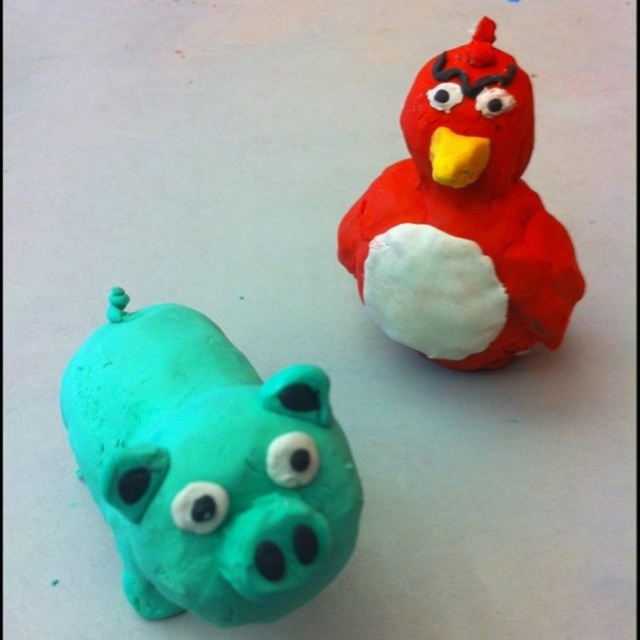
Based on the photo, which is below, teal clay pig at lower left or matte red clay bird at upper right?

teal clay pig at lower left is below.

Is teal clay pig at lower left thinner than matte red clay bird at upper right?

No, teal clay pig at lower left is not thinner than matte red clay bird at upper right.

What are the coordinates of `teal clay pig at lower left` in the screenshot? It's located at (209, 467).

I want to click on teal clay pig at lower left, so click(x=209, y=467).